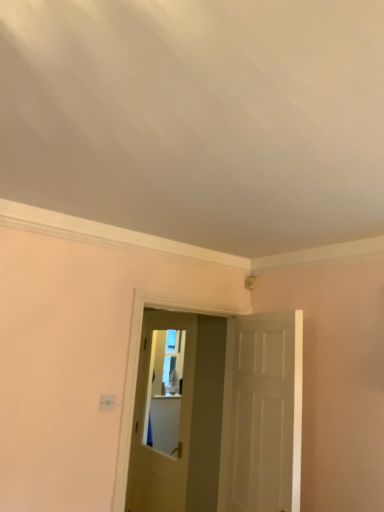
Question: Is matte white door at center, the first door when ordered from left to right, shorter than white plastic light switch at lower left?

Choices:
 (A) yes
 (B) no

Answer: (B)

Question: From the image's perspective, is matte white door at center, the second door when ordered from right to left, located above white plastic light switch at lower left?

Choices:
 (A) no
 (B) yes

Answer: (A)

Question: From the image's perspective, is matte white door at center, the first door when ordered from left to right, under white plastic light switch at lower left?

Choices:
 (A) yes
 (B) no

Answer: (A)

Question: Does matte white door at center, which is counted as the 1th door, starting from the back, come behind white plastic light switch at lower left?

Choices:
 (A) no
 (B) yes

Answer: (B)

Question: Does matte white door at center, positioned as the second door in front-to-back order, have a greater width compared to white plastic light switch at lower left?

Choices:
 (A) no
 (B) yes

Answer: (B)

Question: Based on their sizes in the image, would you say white matte door at center, which is the second door in left-to-right order, is bigger or smaller than matte white door at center, the second door when ordered from right to left?

Choices:
 (A) small
 (B) big

Answer: (A)

Question: Relative to matte white door at center, the first door when ordered from left to right, is white matte door at center, which is counted as the 2th door, starting from the back, in front or behind?

Choices:
 (A) front
 (B) behind

Answer: (A)

Question: From the image's perspective, is white matte door at center, which is the 1th door from front to back, above or below matte white door at center, which is counted as the 1th door, starting from the back?

Choices:
 (A) above
 (B) below

Answer: (A)

Question: From a real-world perspective, is white matte door at center, which is counted as the 2th door, starting from the back, above or below matte white door at center, which is counted as the 1th door, starting from the back?

Choices:
 (A) below
 (B) above

Answer: (B)

Question: Considering the positions of white plastic light switch at lower left and matte white door at center, the second door when ordered from right to left, in the image, is white plastic light switch at lower left wider or thinner than matte white door at center, the second door when ordered from right to left,?

Choices:
 (A) wide
 (B) thin

Answer: (B)

Question: Considering the positions of white plastic light switch at lower left and matte white door at center, positioned as the second door in front-to-back order, in the image, is white plastic light switch at lower left taller or shorter than matte white door at center, positioned as the second door in front-to-back order,?

Choices:
 (A) short
 (B) tall

Answer: (A)

Question: In the image, is white plastic light switch at lower left positioned in front of or behind matte white door at center, the second door when ordered from right to left?

Choices:
 (A) behind
 (B) front

Answer: (B)

Question: From the image's perspective, is white plastic light switch at lower left positioned above or below matte white door at center, positioned as the second door in front-to-back order?

Choices:
 (A) above
 (B) below

Answer: (A)

Question: In terms of size, does matte white door at center, which is counted as the 1th door, starting from the back, appear bigger or smaller than white matte door at center, which is counted as the 2th door, starting from the back?

Choices:
 (A) small
 (B) big

Answer: (B)

Question: From a real-world perspective, is matte white door at center, positioned as the second door in front-to-back order, physically located above or below white matte door at center, which is counted as the 2th door, starting from the back?

Choices:
 (A) below
 (B) above

Answer: (A)